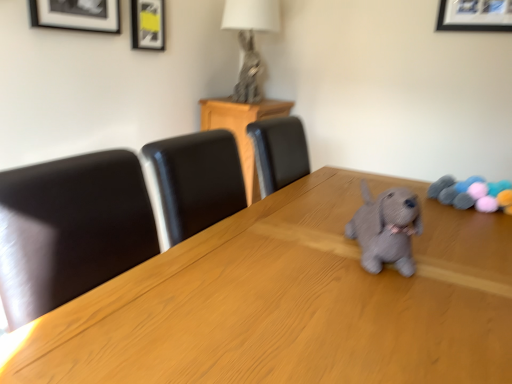
Find the location of a particular element. This screenshot has height=384, width=512. free space in front of gray knitted stuffed animal at right is located at coordinates (473, 225).